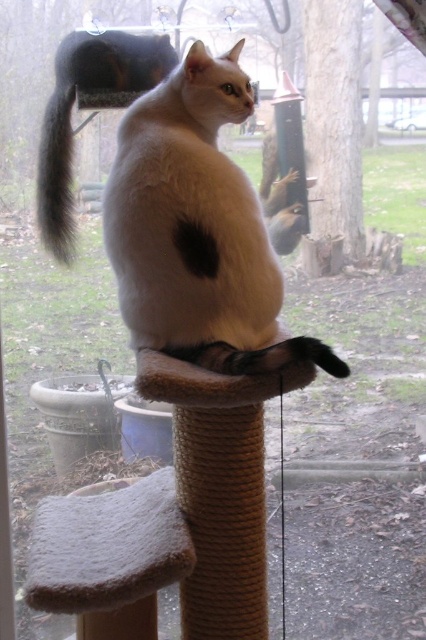
Question: Among these points, which one is nearest to the camera?

Choices:
 (A) (54, 154)
 (B) (221, 64)

Answer: (B)

Question: Among these points, which one is farthest from the camera?

Choices:
 (A) (224, 550)
 (B) (62, 230)
 (C) (54, 131)
 (D) (252, 353)

Answer: (C)

Question: Can you confirm if sisal rope cat tree at center is bigger than white fur cat at upper center?

Choices:
 (A) yes
 (B) no

Answer: (B)

Question: Estimate the real-world distances between objects in this image. Which object is farther from the black fur tail at center?

Choices:
 (A) white fur cat at upper center
 (B) sisal rope cat tree at center
 (C) white fluffy cat at center

Answer: (A)

Question: Can you confirm if white fur cat at upper center is wider than black fur tail at center?

Choices:
 (A) yes
 (B) no

Answer: (A)

Question: Can you confirm if white fluffy cat at center is positioned to the left of white fur cat at upper center?

Choices:
 (A) yes
 (B) no

Answer: (B)